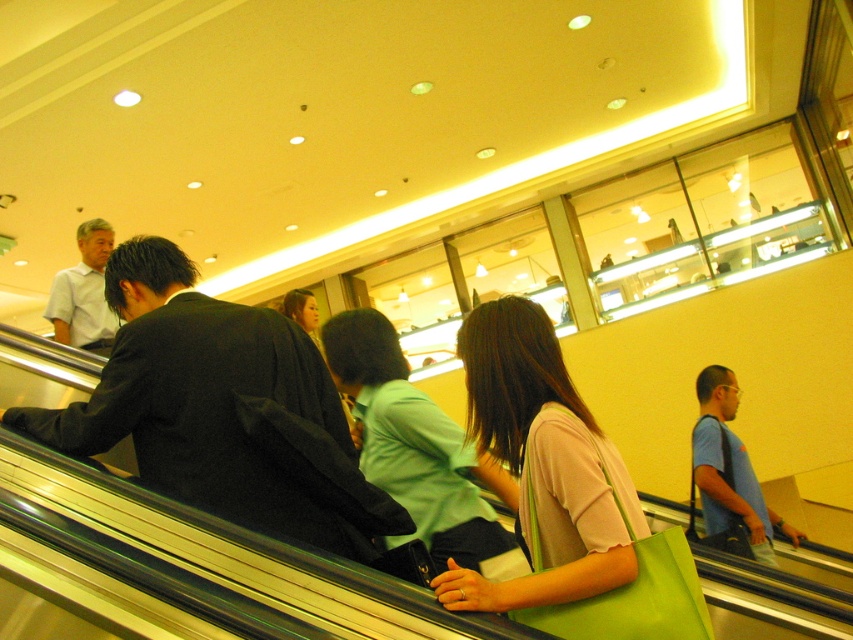
Question: Which point appears farthest from the camera in this image?

Choices:
 (A) (82, 292)
 (B) (712, 451)
 (C) (462, 506)

Answer: (A)

Question: Can you confirm if pink fabric bag at center is positioned to the left of blue cotton shirt at right?

Choices:
 (A) yes
 (B) no

Answer: (A)

Question: From the image, what is the correct spatial relationship of black matte jacket at left in relation to blue cotton shirt at right?

Choices:
 (A) above
 (B) below

Answer: (A)

Question: Estimate the real-world distances between objects in this image. Which object is farther from the black matte jacket at left?

Choices:
 (A) pink fabric bag at center
 (B) green matte shirt at center
 (C) white shirt at left
 (D) blue cotton shirt at right

Answer: (D)

Question: Which point appears closest to the camera in this image?

Choices:
 (A) (161, 440)
 (B) (79, 304)

Answer: (A)

Question: Can you confirm if pink fabric bag at center is positioned to the left of green matte shirt at center?

Choices:
 (A) yes
 (B) no

Answer: (B)